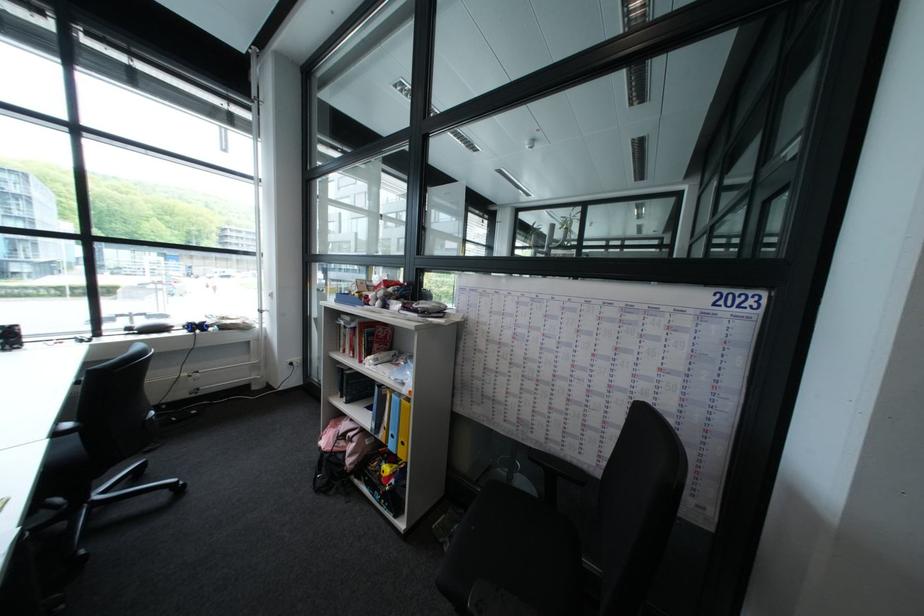
At what (x,y) coordinates should I click in order to perform the action: click on window crank handle. Please return your answer as a coordinate pair (x, y). Looking at the image, I should click on (261, 310).